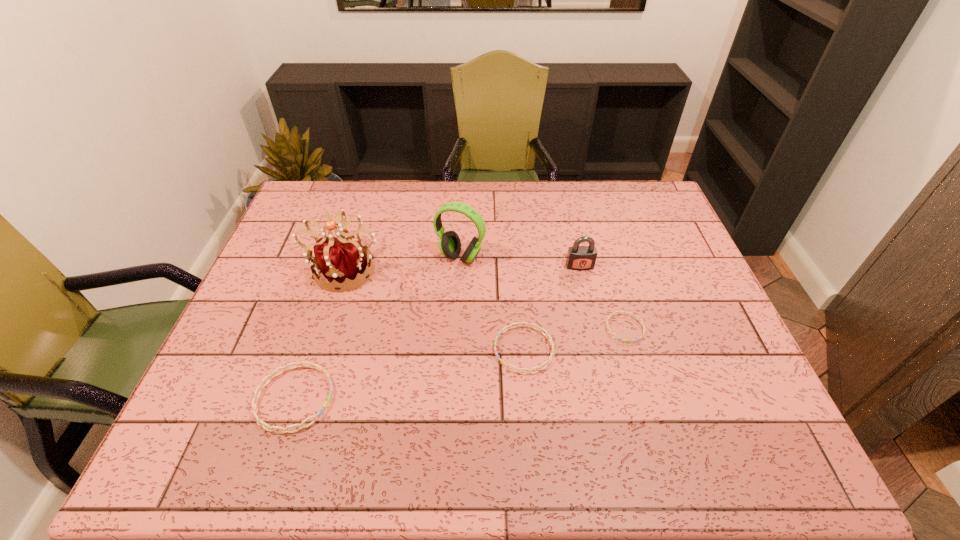
This screenshot has height=540, width=960. In the image, there is a desktop. Identify the location of free space at the far edge. (354, 199).

Identify the location of vacant area at the near edge. This screenshot has width=960, height=540. (617, 395).

What are the coordinates of `vacant space at the left edge of the desktop` in the screenshot? It's located at (282, 252).

This screenshot has height=540, width=960. I want to click on free space at the right edge, so click(x=667, y=280).

Identify the location of vacant area at the far left corner of the desktop. The height and width of the screenshot is (540, 960). (320, 216).

This screenshot has height=540, width=960. I want to click on free space at the far right corner of the desktop, so click(x=621, y=188).

What are the coordinates of `free space between the third object from left to right and the tiara` in the screenshot? It's located at (402, 263).

This screenshot has width=960, height=540. Find the location of `free space between the padlock and the third object from left to right`. free space between the padlock and the third object from left to right is located at coordinates (520, 262).

Where is `unoccupied position between the leftmost bracelet and the shortest bracelet`? The image size is (960, 540). unoccupied position between the leftmost bracelet and the shortest bracelet is located at coordinates pos(460,363).

Where is `free space between the fourth shortest object and the leftmost bracelet`? The image size is (960, 540). free space between the fourth shortest object and the leftmost bracelet is located at coordinates (437, 332).